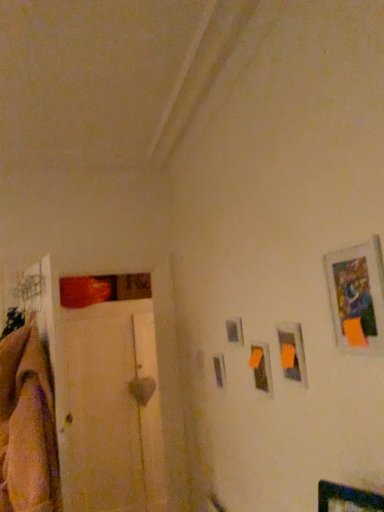
Question: Does matte plastic picture frame at center, which is the third picture frame from front to back, have a greater height compared to metallic silver picture frame at center-right, the 1th picture frame viewed from the back?

Choices:
 (A) yes
 (B) no

Answer: (A)

Question: Is matte plastic picture frame at center, which is counted as the 2th picture frame, starting from the back, next to metallic silver picture frame at center-right, the 1th picture frame viewed from the left?

Choices:
 (A) no
 (B) yes

Answer: (A)

Question: Can you confirm if matte plastic picture frame at center, which is counted as the 3th picture frame, starting from the right, is shorter than metallic silver picture frame at center-right, the 1th picture frame viewed from the left?

Choices:
 (A) yes
 (B) no

Answer: (B)

Question: Is matte plastic picture frame at center, which is counted as the 2th picture frame, starting from the back, further to the viewer compared to metallic silver picture frame at center-right, the 1th picture frame viewed from the back?

Choices:
 (A) no
 (B) yes

Answer: (A)

Question: Can you confirm if matte plastic picture frame at center, which is the third picture frame from front to back, is smaller than metallic silver picture frame at center-right, positioned as the fourth picture frame in right-to-left order?

Choices:
 (A) no
 (B) yes

Answer: (A)

Question: Is matte plastic picture frame at center, which is counted as the 3th picture frame, starting from the right, closer to the viewer compared to metallic silver picture frame at center-right, the 1th picture frame viewed from the back?

Choices:
 (A) yes
 (B) no

Answer: (A)

Question: Is matte plastic picture frame at upper right, acting as the 3th picture frame starting from the left, closer to camera compared to metallic silver picture frame at upper right, which is the fourth picture frame from back to front?

Choices:
 (A) no
 (B) yes

Answer: (A)

Question: Is the position of matte plastic picture frame at upper right, the second picture frame from the front, more distant than that of metallic silver picture frame at upper right, which is the 4th picture frame from left to right?

Choices:
 (A) no
 (B) yes

Answer: (B)

Question: Is matte plastic picture frame at upper right, which is counted as the second picture frame, starting from the right, wider than metallic silver picture frame at upper right, which is the 4th picture frame from left to right?

Choices:
 (A) yes
 (B) no

Answer: (A)

Question: Can you confirm if matte plastic picture frame at upper right, which is counted as the second picture frame, starting from the right, is bigger than metallic silver picture frame at upper right, acting as the first picture frame starting from the front?

Choices:
 (A) yes
 (B) no

Answer: (B)

Question: From a real-world perspective, is matte plastic picture frame at upper right, which is counted as the second picture frame, starting from the right, beneath metallic silver picture frame at upper right, acting as the first picture frame starting from the front?

Choices:
 (A) yes
 (B) no

Answer: (A)

Question: Are matte plastic picture frame at upper right, the second picture frame from the front, and metallic silver picture frame at upper right, the 1th picture frame viewed from the right, located far from each other?

Choices:
 (A) yes
 (B) no

Answer: (B)

Question: Is the position of metallic silver picture frame at center-right, positioned as the fourth picture frame in right-to-left order, less distant than that of soft beige blanket at left?

Choices:
 (A) no
 (B) yes

Answer: (A)